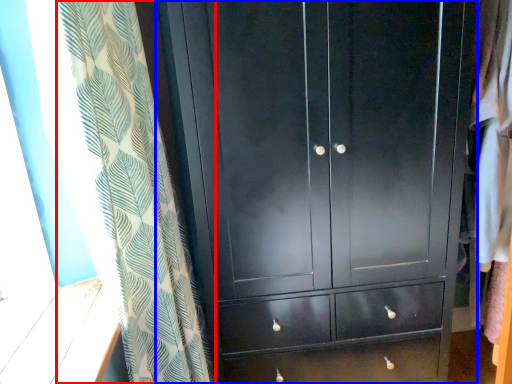
Question: Which object is further to the camera taking this photo, curtain (highlighted by a red box) or cupboard (highlighted by a blue box)?

Choices:
 (A) curtain
 (B) cupboard

Answer: (B)